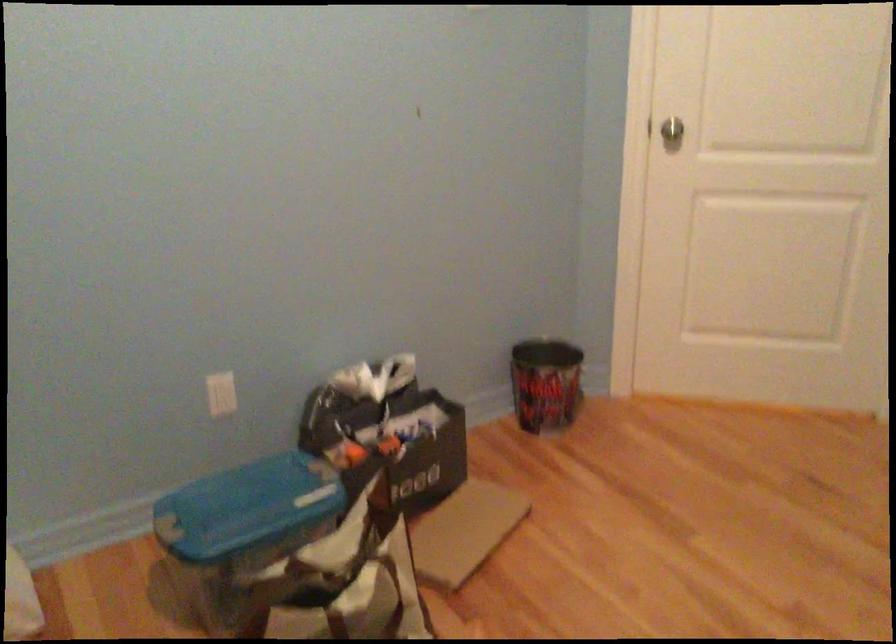
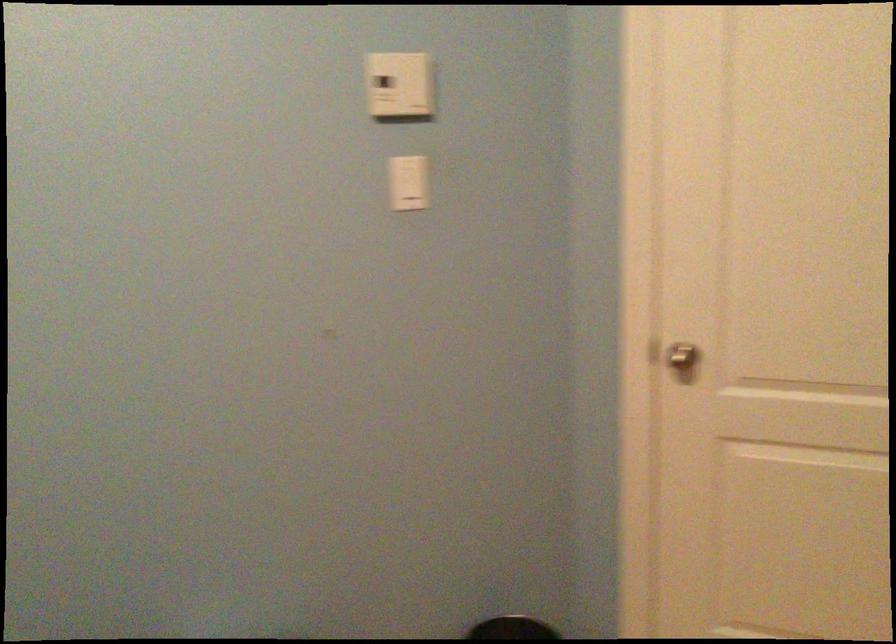
Question: The first image is from the beginning of the video and the second image is from the end. How did the camera likely rotate when shooting the video?

Choices:
 (A) Left
 (B) Right
 (C) Up
 (D) Down

Answer: (A)